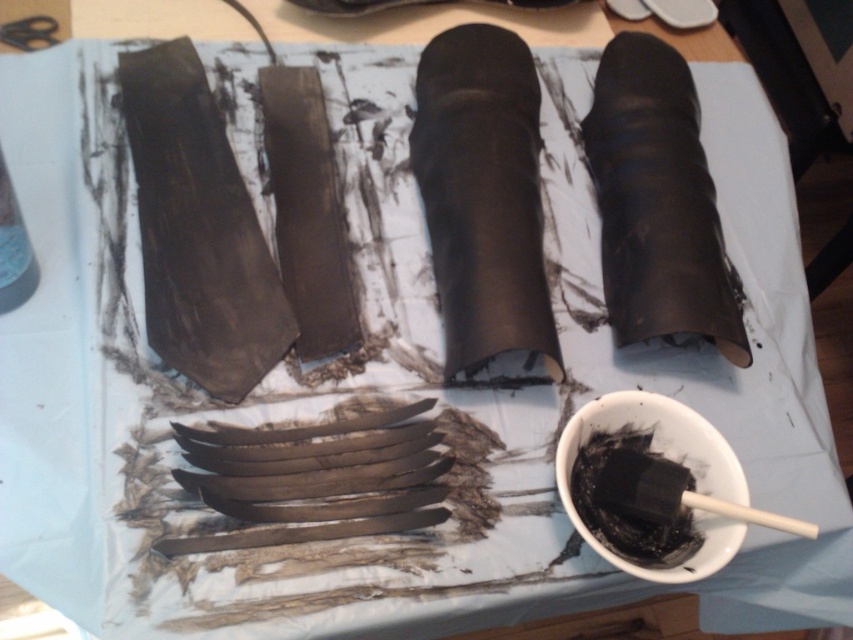
How distant is matte black boot at right from black matte bowl at lower right?

They are 8.21 inches apart.

Image resolution: width=853 pixels, height=640 pixels. What do you see at coordinates (657, 200) in the screenshot? I see `matte black boot at right` at bounding box center [657, 200].

This screenshot has height=640, width=853. Find the location of `matte black boot at right`. matte black boot at right is located at coordinates (657, 200).

Is matte black boot at center to the right of black matte bowl at lower right from the viewer's perspective?

In fact, matte black boot at center is to the left of black matte bowl at lower right.

Between matte black boot at center and black matte bowl at lower right, which one is positioned higher?

Positioned higher is matte black boot at center.

I want to click on matte black boot at center, so click(x=483, y=196).

Does matte black boot at center appear under matte black boot at right?

Indeed, matte black boot at center is positioned under matte black boot at right.

Who is positioned more to the left, matte black boot at center or matte black boot at right?

From the viewer's perspective, matte black boot at center appears more on the left side.

The width and height of the screenshot is (853, 640). What do you see at coordinates (483, 196) in the screenshot? I see `matte black boot at center` at bounding box center [483, 196].

Find the location of a particular element. This screenshot has width=853, height=640. matte black boot at center is located at coordinates (483, 196).